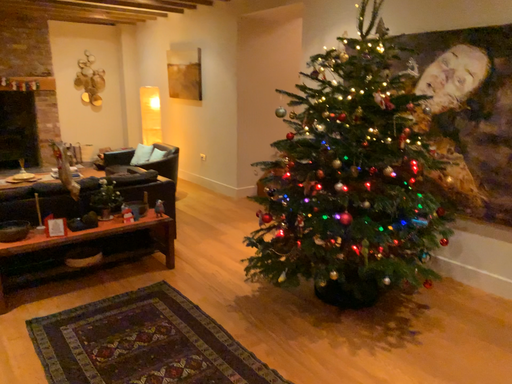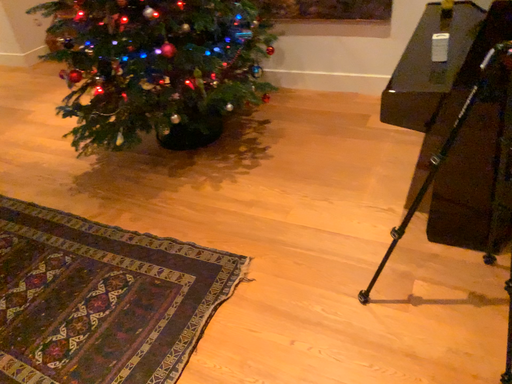
Question: Which way did the camera rotate in the video?

Choices:
 (A) rotated right
 (B) rotated left

Answer: (A)